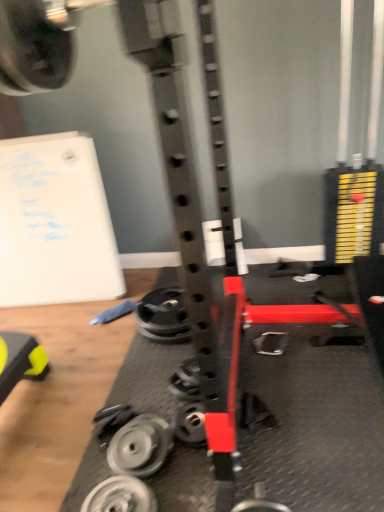
At what (x,y) coordinates should I click in order to perform the action: click on empty space that is ontop of silver metallic weight at center-left, the 2th wheel from the front (from a real-world perspective). Please return your answer as a coordinate pair (x, y). Looking at the image, I should click on (134, 444).